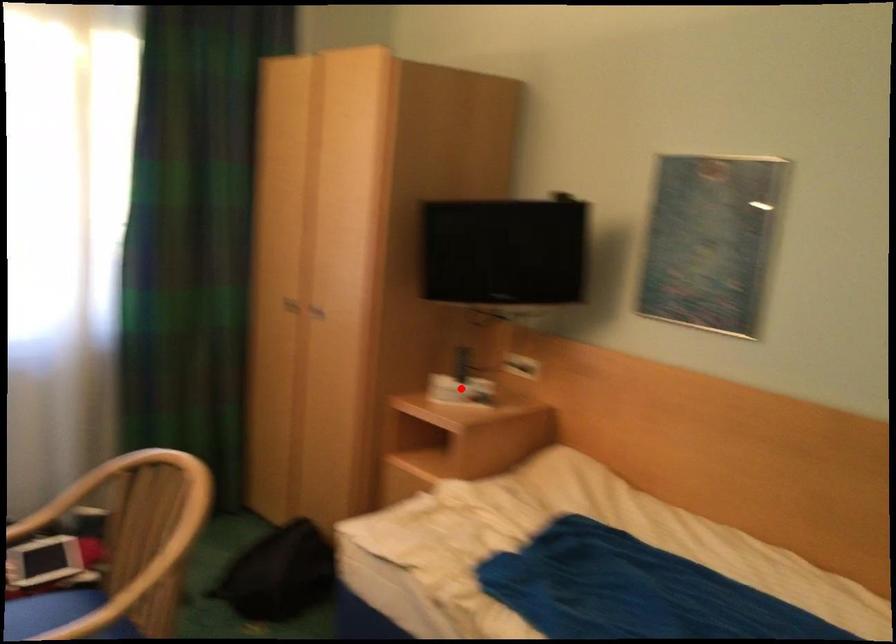
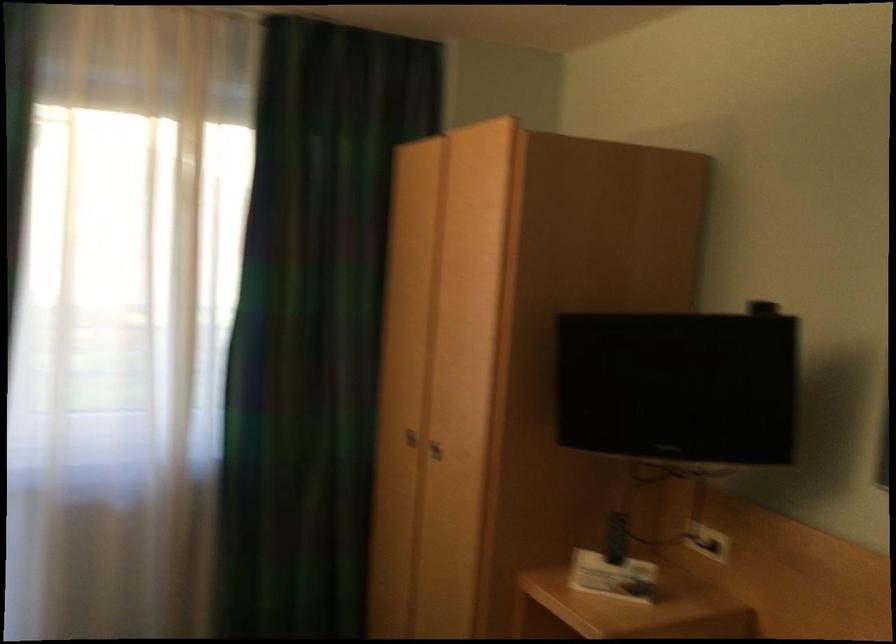
Question: I am providing you with two images of the same scene from different viewpoints. In image1, a red point is highlighted. Considering the same 3D point in image2, which of the following is correct?

Choices:
 (A) It is closer
 (B) It is farther

Answer: (A)